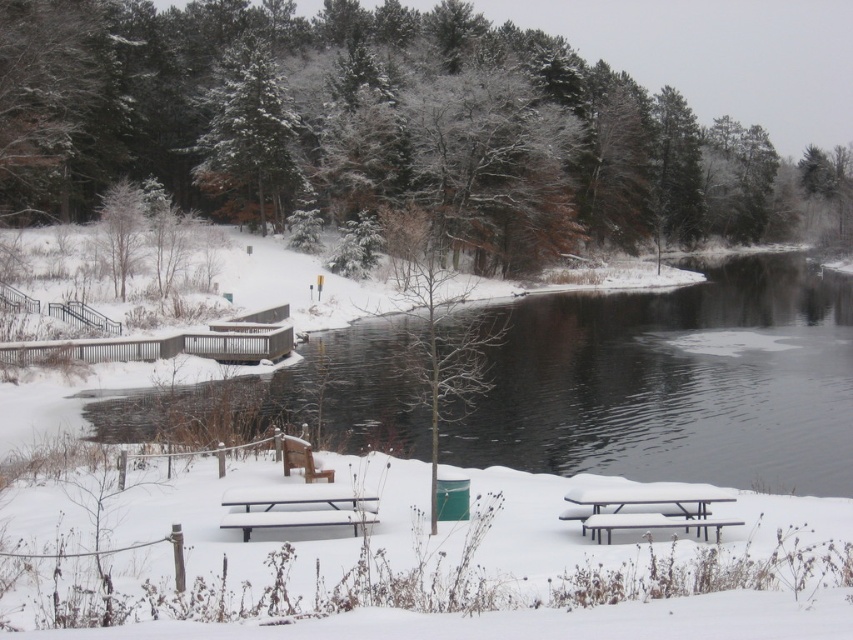
You are a GUI agent. You are given a task and a screenshot of the screen. Output one action in this format:
    pyautogui.click(x=<x>, y=<y>)
    Task: Click on the snow-covered evergreen at upper center
    The height and width of the screenshot is (640, 853).
    Given the screenshot: What is the action you would take?
    pyautogui.click(x=247, y=138)

Is snow-covered evergreen at upper center positioned in front of white metallic picnic table at lower right?

No.

Where is `snow-covered evergreen at upper center`? The height and width of the screenshot is (640, 853). snow-covered evergreen at upper center is located at coordinates (247, 138).

Find the location of a particular element. snow-covered evergreen at upper center is located at coordinates (247, 138).

Which is more to the right, green textured tree at center or wooden bench at center?

Positioned to the right is green textured tree at center.

Which is in front, point (670, 225) or point (306, 456)?

Positioned in front is point (306, 456).

Find the location of a particular element. green textured tree at center is located at coordinates (368, 125).

Does point (584, 504) come behind point (677, 524)?

Yes, point (584, 504) is farther from viewer.

Is white metallic picnic table at lower right above white plastic picnic table at lower right?

Indeed, white metallic picnic table at lower right is positioned over white plastic picnic table at lower right.

Does point (631, 500) come farther from viewer compared to point (682, 522)?

Yes, point (631, 500) is farther from viewer.

This screenshot has width=853, height=640. Find the location of `white metallic picnic table at lower right`. white metallic picnic table at lower right is located at coordinates (647, 508).